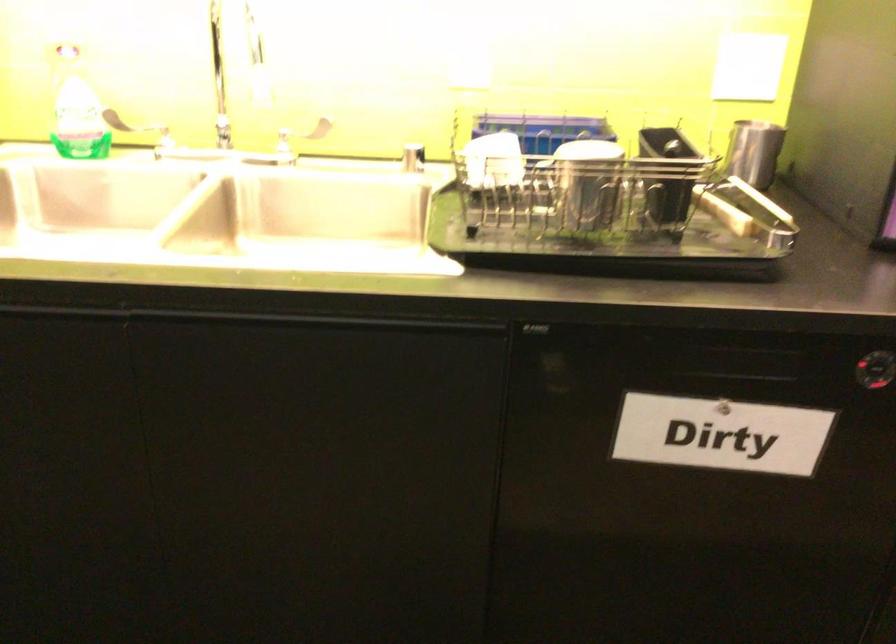
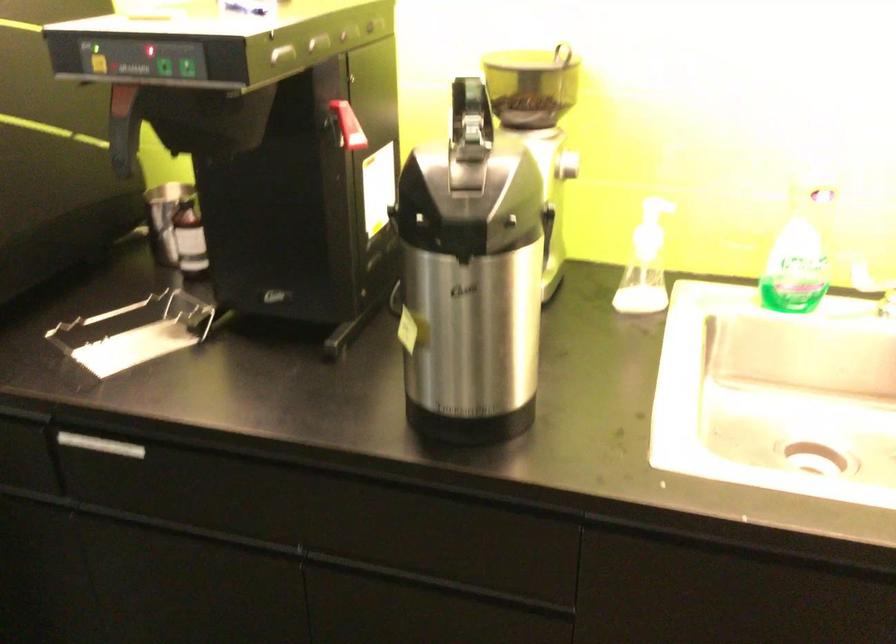
Question: The first image is from the beginning of the video and the second image is from the end. How did the camera likely rotate when shooting the video?

Choices:
 (A) Left
 (B) Right
 (C) Up
 (D) Down

Answer: (A)